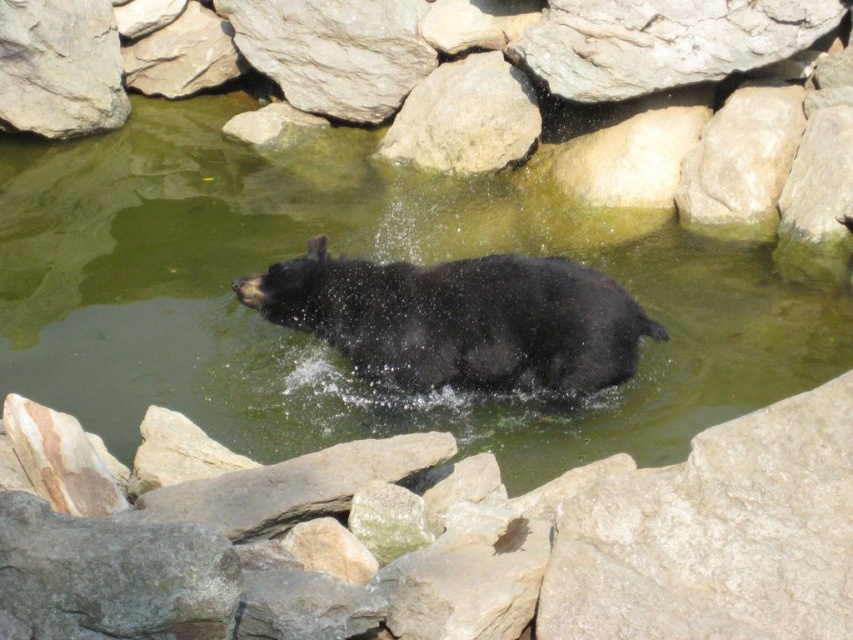
Between point (312, 289) and point (511, 120), which one is positioned behind?

Point (511, 120)

Who is taller, black matte bear at center or smooth gray rock at upper center?

Standing taller between the two is smooth gray rock at upper center.

Is point (508, 385) in front of point (520, 97)?

Yes, point (508, 385) is in front of point (520, 97).

Locate an element on the screen. black matte bear at center is located at coordinates (460, 321).

Between green liquid water at center and gray rough rock at lower right, which one appears on the left side from the viewer's perspective?

green liquid water at center

From the picture: Which is above, green liquid water at center or gray rough rock at lower right?

green liquid water at center

I want to click on green liquid water at center, so click(x=352, y=253).

Is the position of green liquid water at center less distant than that of smooth gray rock at upper center?

Yes.

Which is behind, point (726, 417) or point (494, 150)?

Positioned behind is point (494, 150).

Is point (682, 355) behind point (439, 163)?

No, (682, 355) is closer to viewer.

Find the location of `green liquid water at center`. green liquid water at center is located at coordinates (352, 253).